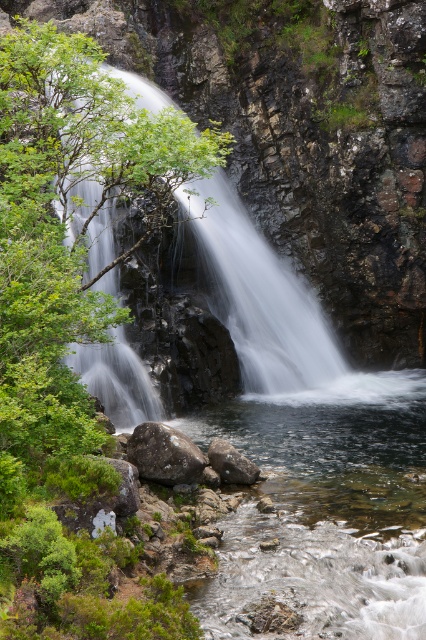
You are a hiker trying to cross the river below the waterfall. You see two rocks in the water. The gray rough rock at lower center and the gray rock at center. Which rock is wider and can provide a better stepping stone?

The gray rough rock at lower center is wider than the gray rock at center, so it can provide a better stepping stone.

You are planning to place a small bench between the green leafy tree at center and the gray rough rock at lower center for visitors to rest. Given that the bench requires 8 feet of space, will there be enough room between them?

The green leafy tree at center and gray rough rock at lower center are 9.23 feet apart from each other, so yes, there is enough space to place the bench between them since 9.23 feet is greater than the required 8 feet.

You are standing at the edge of the waterfall in the image and notice a specific point marked at coordinates point (164,454). Based on the scene description, can you determine what surface this point is located on?

The point (164,454) is located on the gray rough rock at lower center.